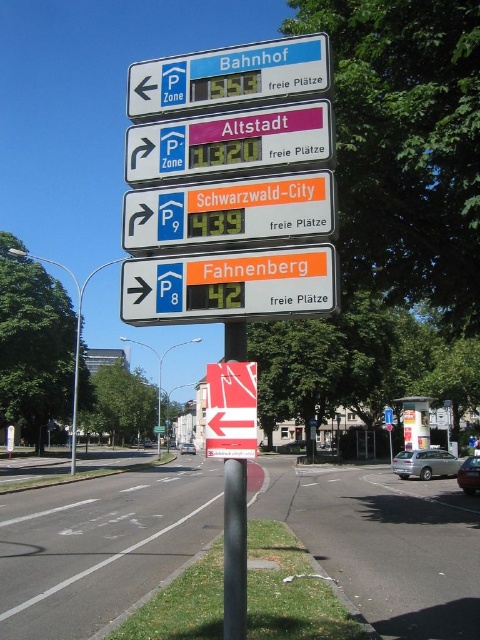
How much distance is there between orange plastic sign at center and metallic pole at center?

The distance of orange plastic sign at center from metallic pole at center is 1.83 meters.

Can you confirm if orange plastic sign at center is positioned to the left of metallic pole at center?

Incorrect, orange plastic sign at center is not on the left side of metallic pole at center.

Is point (262, 208) more distant than point (238, 628)?

Yes, point (262, 208) is behind point (238, 628).

The height and width of the screenshot is (640, 480). In order to click on orange plastic sign at center in this screenshot , I will do `click(228, 211)`.

Looking at this image, between orange plastic sign at center and pink fabric altstadt at upper center, which one has more height?

Standing taller between the two is orange plastic sign at center.

Between orange plastic sign at center and pink fabric altstadt at upper center, which one is positioned higher?

pink fabric altstadt at upper center

Does point (327, 177) come behind point (325, 157)?

Yes, it is.

Find the location of a particular element. orange plastic sign at center is located at coordinates [x=228, y=211].

Can you confirm if orange plastic parking sign at lower center is thinner than blue plastic sign at upper left?

Correct, orange plastic parking sign at lower center's width is less than blue plastic sign at upper left's.

Is orange plastic parking sign at lower center to the right of blue plastic sign at upper left from the viewer's perspective?

Indeed, orange plastic parking sign at lower center is positioned on the right side of blue plastic sign at upper left.

Is point (189, 321) farther from camera compared to point (180, 108)?

No.

The width and height of the screenshot is (480, 640). What are the coordinates of `orange plastic parking sign at lower center` in the screenshot? It's located at (229, 285).